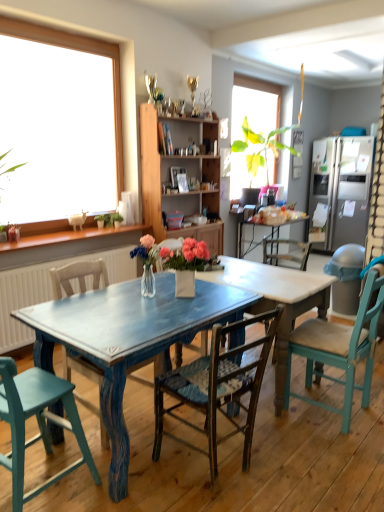
Question: Is wooden cabinet at center in contact with satin silver refrigerator at right?

Choices:
 (A) yes
 (B) no

Answer: (B)

Question: Is wooden cabinet at center further to the viewer compared to satin silver refrigerator at right?

Choices:
 (A) no
 (B) yes

Answer: (A)

Question: Could you tell me if wooden cabinet at center is turned towards satin silver refrigerator at right?

Choices:
 (A) yes
 (B) no

Answer: (B)

Question: Is the depth of wooden cabinet at center less than that of satin silver refrigerator at right?

Choices:
 (A) no
 (B) yes

Answer: (B)

Question: Is wooden cabinet at center wider than satin silver refrigerator at right?

Choices:
 (A) no
 (B) yes

Answer: (A)

Question: Considering the relative positions of wooden cabinet at center and satin silver refrigerator at right in the image provided, is wooden cabinet at center to the left of satin silver refrigerator at right from the viewer's perspective?

Choices:
 (A) no
 (B) yes

Answer: (B)

Question: Is distressed blue table at center a part of teal wood chair at right, the 1th chair positioned from the right?

Choices:
 (A) no
 (B) yes

Answer: (A)

Question: From the image's perspective, does teal wood chair at right, which is the fourth chair in left-to-right order, appear lower than distressed blue table at center?

Choices:
 (A) no
 (B) yes

Answer: (A)

Question: Is teal wood chair at right, which is the fourth chair in left-to-right order, closer to the viewer compared to distressed blue table at center?

Choices:
 (A) yes
 (B) no

Answer: (A)

Question: From a real-world perspective, is teal wood chair at right, the 1th chair positioned from the right, on top of distressed blue table at center?

Choices:
 (A) yes
 (B) no

Answer: (A)

Question: Is teal wood chair at right, the 1th chair positioned from the right, wider than distressed blue table at center?

Choices:
 (A) no
 (B) yes

Answer: (A)

Question: Could you tell me if teal wood chair at right, which is the fourth chair in left-to-right order, is turned towards distressed blue table at center?

Choices:
 (A) no
 (B) yes

Answer: (B)

Question: Is distressed blue table at center placed right next to wooden woven seat chair at center, the second chair viewed from the right?

Choices:
 (A) no
 (B) yes

Answer: (A)